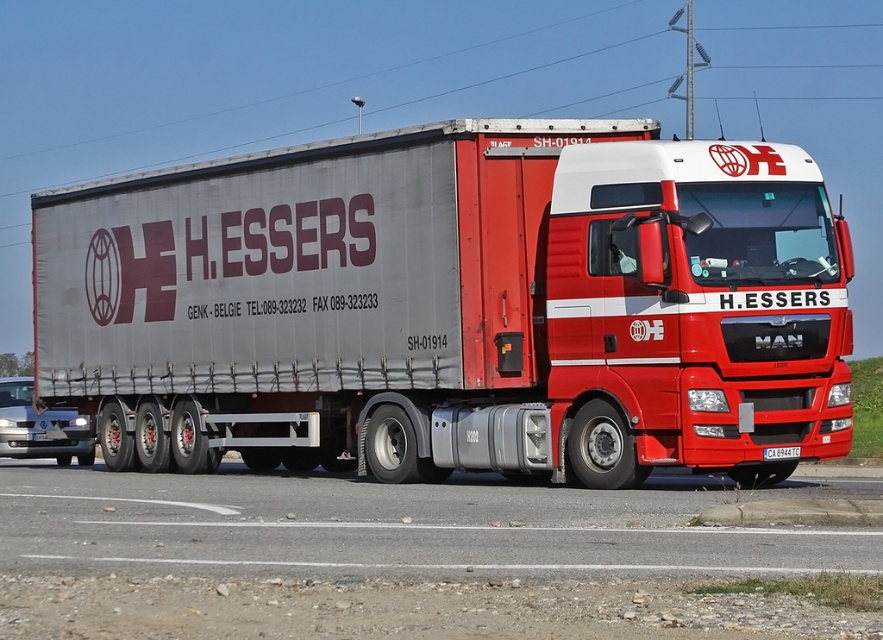
Can you confirm if metallic silver trailer truck at center is positioned above gray asphalt road at lower center?

Yes, metallic silver trailer truck at center is above gray asphalt road at lower center.

Locate an element on the screen. Image resolution: width=883 pixels, height=640 pixels. metallic silver trailer truck at center is located at coordinates (454, 305).

The image size is (883, 640). Find the location of `metallic silver trailer truck at center`. metallic silver trailer truck at center is located at coordinates (454, 305).

Between metallic wire at upper center and gray asphalt road at lower center, which one has more height?

Standing taller between the two is metallic wire at upper center.

I want to click on metallic wire at upper center, so click(292, 83).

The height and width of the screenshot is (640, 883). I want to click on metallic wire at upper center, so click(x=292, y=83).

Locate an element on the screen. The width and height of the screenshot is (883, 640). metallic wire at upper center is located at coordinates (292, 83).

Where is `metallic silver trailer truck at center`? This screenshot has height=640, width=883. metallic silver trailer truck at center is located at coordinates (454, 305).

Does metallic silver trailer truck at center have a lesser width compared to metallic wire at upper center?

Indeed, metallic silver trailer truck at center has a lesser width compared to metallic wire at upper center.

Between point (514, 365) and point (157, 17), which one is positioned in front?

Point (514, 365)

Where is `metallic silver trailer truck at center`? This screenshot has height=640, width=883. metallic silver trailer truck at center is located at coordinates (454, 305).